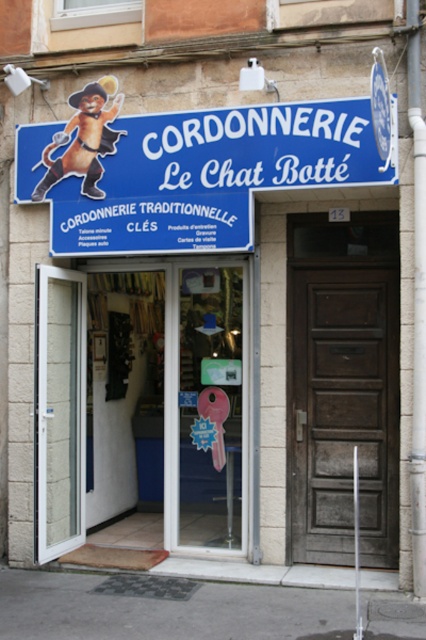
Can you confirm if dark wood door at center is smaller than white plastic door at left?

Incorrect, dark wood door at center is not smaller in size than white plastic door at left.

Where is `dark wood door at center`? The image size is (426, 640). dark wood door at center is located at coordinates pyautogui.click(x=342, y=385).

The width and height of the screenshot is (426, 640). Identify the location of dark wood door at center. (342, 385).